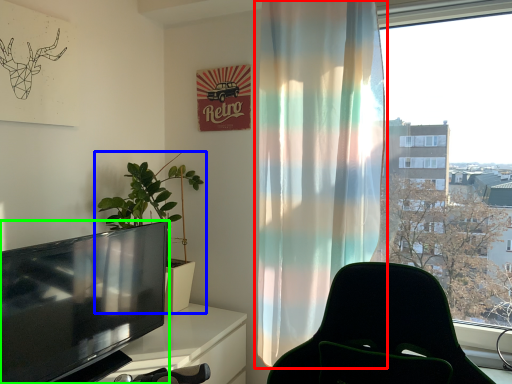
Question: Which object is the closest to the curtain (highlighted by a red box)? Choose among these: houseplant (highlighted by a blue box) or television (highlighted by a green box).

Choices:
 (A) houseplant
 (B) television

Answer: (B)